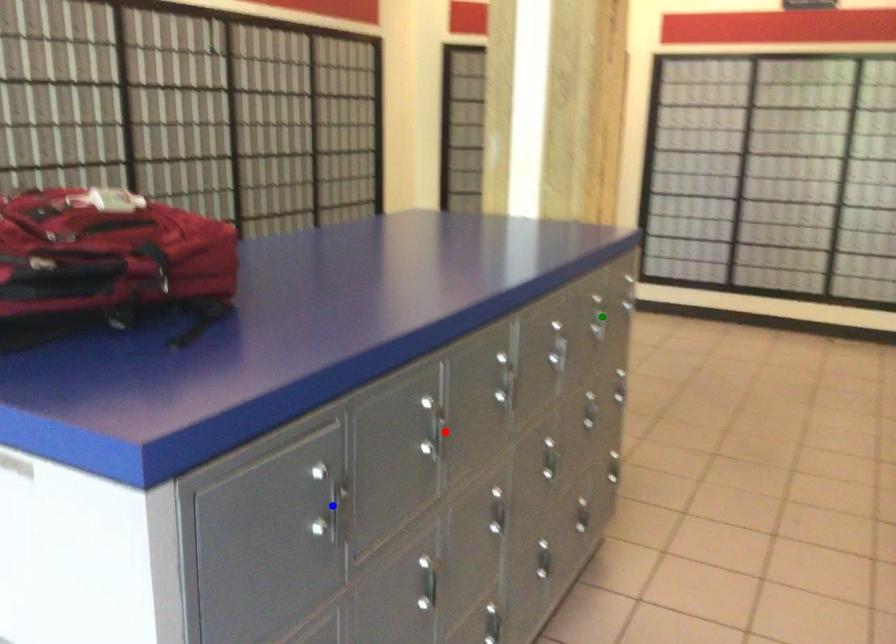
Order these from nearest to farthest:
blue point, green point, red point

1. green point
2. red point
3. blue point